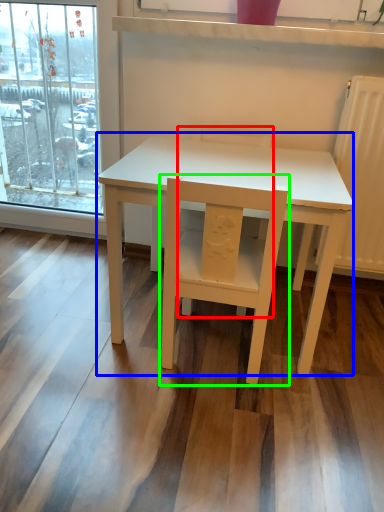
Question: Considering the real-world distances, which object is farthest from chair (highlighted by a red box)? table (highlighted by a blue box) or chair (highlighted by a green box)?

Choices:
 (A) table
 (B) chair

Answer: (B)